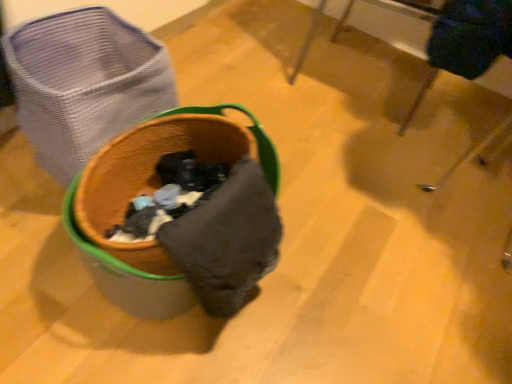
What do you see at coordinates (84, 83) in the screenshot?
I see `rattan laundry basket at left` at bounding box center [84, 83].

The height and width of the screenshot is (384, 512). Find the location of `rattan laundry basket at left`. rattan laundry basket at left is located at coordinates (84, 83).

What do you see at coordinates (451, 67) in the screenshot?
I see `wooden table at upper center` at bounding box center [451, 67].

This screenshot has width=512, height=384. In order to click on wooden table at upper center in this screenshot , I will do pyautogui.click(x=451, y=67).

I want to click on rattan laundry basket at left, so click(84, 83).

Can you confirm if rattan laundry basket at left is positioned to the left of wooden table at upper center?

Indeed, rattan laundry basket at left is positioned on the left side of wooden table at upper center.

From the picture: Which object is closer to the camera taking this photo, rattan laundry basket at left or wooden table at upper center?

rattan laundry basket at left is more forward.

Does point (130, 85) come behind point (351, 5)?

No, (130, 85) is closer to viewer.

From the image's perspective, does rattan laundry basket at left appear higher than wooden table at upper center?

No, from the image's perspective, rattan laundry basket at left is not over wooden table at upper center.

From a real-world perspective, which is physically above, rattan laundry basket at left or wooden table at upper center?

wooden table at upper center, from a real-world perspective.

Between rattan laundry basket at left and wooden table at upper center, which one has smaller width?

Thinner between the two is rattan laundry basket at left.

Between rattan laundry basket at left and wooden table at upper center, which one has more height?

With more height is wooden table at upper center.

In terms of size, does rattan laundry basket at left appear bigger or smaller than wooden table at upper center?

Considering their sizes, rattan laundry basket at left takes up less space than wooden table at upper center.

Is wooden table at upper center located within rattan laundry basket at left?

Definitely not — wooden table at upper center is not inside rattan laundry basket at left.

Are rattan laundry basket at left and wooden table at upper center beside each other?

No, rattan laundry basket at left is not touching wooden table at upper center.

Is rattan laundry basket at left aimed at wooden table at upper center?

No.

At what (x,y) coordinates should I click in order to perform the action: click on laundry basket below the wooden table at upper center (from the image's perspective). Please return your answer as a coordinate pair (x, y). This screenshot has width=512, height=384. Looking at the image, I should click on (84, 83).

Considering the relative positions of wooden table at upper center and rattan laundry basket at left in the image provided, is wooden table at upper center to the left or to the right of rattan laundry basket at left?

wooden table at upper center is positioned on rattan laundry basket at left's right side.

Which object is closer to the camera, wooden table at upper center or rattan laundry basket at left?

rattan laundry basket at left is in front.

Is point (441, 50) behind point (77, 128)?

Yes, point (441, 50) is farther from viewer.

From the image's perspective, would you say wooden table at upper center is positioned over rattan laundry basket at left?

Correct, wooden table at upper center appears higher than rattan laundry basket at left in the image.

Looking at this image, from a real-world perspective, who is located higher, wooden table at upper center or rattan laundry basket at left?

wooden table at upper center, from a real-world perspective.

Which of these two, wooden table at upper center or rattan laundry basket at left, is thinner?

rattan laundry basket at left.

Who is shorter, wooden table at upper center or rattan laundry basket at left?

With less height is rattan laundry basket at left.

Considering the sizes of objects wooden table at upper center and rattan laundry basket at left in the image provided, who is bigger, wooden table at upper center or rattan laundry basket at left?

Bigger between the two is wooden table at upper center.

Is wooden table at upper center surrounding rattan laundry basket at left?

That's incorrect, rattan laundry basket at left is not inside wooden table at upper center.

Would you consider wooden table at upper center to be distant from rattan laundry basket at left?

No, wooden table at upper center is not far away from rattan laundry basket at left.

Could you tell me if wooden table at upper center is turned towards rattan laundry basket at left?

Yes, wooden table at upper center is facing rattan laundry basket at left.

How different are the orientations of wooden table at upper center and rattan laundry basket at left in degrees?

The angle between the facing direction of wooden table at upper center and the facing direction of rattan laundry basket at left is 76.1 degrees.

Measure the distance between wooden table at upper center and rattan laundry basket at left.

wooden table at upper center is 35.04 inches from rattan laundry basket at left.

Where is `furniture above the rattan laundry basket at left (from a real-world perspective)`? furniture above the rattan laundry basket at left (from a real-world perspective) is located at coordinates (451, 67).

You are a GUI agent. You are given a task and a screenshot of the screen. Output one action in this format:
    pyautogui.click(x=<x>, y=<y>)
    Task: Click on the laundry basket that is on the left side of wooden table at upper center
    This screenshot has width=512, height=384.
    Given the screenshot: What is the action you would take?
    pyautogui.click(x=84, y=83)

Locate an element on the screen. furniture on the right of rattan laundry basket at left is located at coordinates (451, 67).